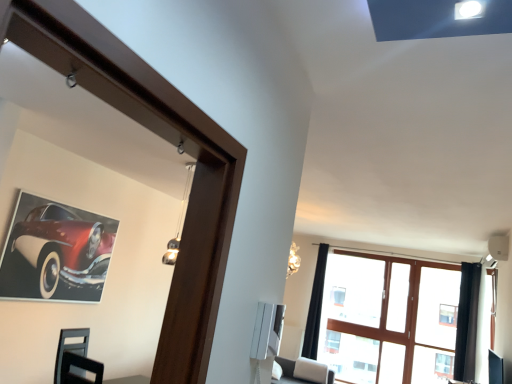
How much space does black velvet curtain at right, which appears as the 1th curtain when viewed from the right, occupy horizontally?

11.56 inches.

The width and height of the screenshot is (512, 384). What do you see at coordinates (315, 306) in the screenshot?
I see `black fabric curtain at upper right, marked as the second curtain in a right-to-left arrangement` at bounding box center [315, 306].

Find the location of a particular element. This screenshot has height=384, width=512. clear glass window at upper center is located at coordinates (391, 318).

Between clear glass window at upper center and black velvet curtain at right, which ranks as the 2th curtain in left-to-right order, which one is positioned in front?

black velvet curtain at right, which ranks as the 2th curtain in left-to-right order, is in front.

Does point (409, 359) lie in front of point (474, 348)?

No, (409, 359) is further to viewer.

Considering the sizes of objects clear glass window at upper center and black velvet curtain at right, which appears as the 2th curtain when viewed from the back, in the image provided, who is thinner, clear glass window at upper center or black velvet curtain at right, which appears as the 2th curtain when viewed from the back,?

With smaller width is clear glass window at upper center.

Considering the sizes of clear glass window at upper center and black velvet curtain at right, which ranks as the 2th curtain in left-to-right order, in the image, is clear glass window at upper center bigger or smaller than black velvet curtain at right, which ranks as the 2th curtain in left-to-right order,?

Clearly, clear glass window at upper center is larger in size than black velvet curtain at right, which ranks as the 2th curtain in left-to-right order.

Which is behind, point (403, 330) or point (321, 302)?

The point (321, 302) is farther.

Which is more to the left, clear glass window at upper center or black fabric curtain at upper right, marked as the second curtain in a right-to-left arrangement?

From the viewer's perspective, black fabric curtain at upper right, marked as the second curtain in a right-to-left arrangement, appears more on the left side.

Is clear glass window at upper center directly adjacent to black fabric curtain at upper right, marked as the second curtain in a right-to-left arrangement?

No, clear glass window at upper center is not in contact with black fabric curtain at upper right, marked as the second curtain in a right-to-left arrangement.

Is clear glass window at upper center turned away from black fabric curtain at upper right, marked as the second curtain in a right-to-left arrangement?

No, black fabric curtain at upper right, marked as the second curtain in a right-to-left arrangement, is not at the back of clear glass window at upper center.

Is point (467, 355) closer or farther from the camera than point (30, 289)?

Point (467, 355) is positioned farther from the camera compared to point (30, 289).

Looking at this image, is black velvet curtain at right, which is the first curtain from front to back, closer to the viewer compared to shiny red car at upper left?

No, it is behind shiny red car at upper left.

Considering the relative sizes of black velvet curtain at right, which is the first curtain from front to back, and shiny red car at upper left in the image provided, is black velvet curtain at right, which is the first curtain from front to back, bigger than shiny red car at upper left?

Correct, black velvet curtain at right, which is the first curtain from front to back, is larger in size than shiny red car at upper left.

Is black fabric curtain at upper right, which ranks as the first curtain in left-to-right order, wider than black velvet curtain at right, which appears as the 2th curtain when viewed from the back?

In fact, black fabric curtain at upper right, which ranks as the first curtain in left-to-right order, might be narrower than black velvet curtain at right, which appears as the 2th curtain when viewed from the back.

Is black fabric curtain at upper right, the 2th curtain from the front, at the left side of black velvet curtain at right, which appears as the 2th curtain when viewed from the back?

Correct, you'll find black fabric curtain at upper right, the 2th curtain from the front, to the left of black velvet curtain at right, which appears as the 2th curtain when viewed from the back.

At what (x,y) coordinates should I click in order to perform the action: click on curtain that is in front of the black fabric curtain at upper right, which ranks as the first curtain in left-to-right order. Please return your answer as a coordinate pair (x, y). Image resolution: width=512 pixels, height=384 pixels. Looking at the image, I should click on (467, 322).

From a real-world perspective, is black fabric curtain at upper right, which ranks as the first curtain in left-to-right order, above or below black velvet curtain at right, which ranks as the 2th curtain in left-to-right order?

black fabric curtain at upper right, which ranks as the first curtain in left-to-right order, is situated lower than black velvet curtain at right, which ranks as the 2th curtain in left-to-right order, in the real world.

Does point (79, 238) lie behind point (328, 300)?

No, it is not.

What's the angular difference between shiny red car at upper left and clear glass window at upper center's facing directions?

The angular difference between shiny red car at upper left and clear glass window at upper center is 90.5 degrees.

Where is `window below the shiny red car at upper left (from the image's perspective)`? The image size is (512, 384). window below the shiny red car at upper left (from the image's perspective) is located at coordinates (391, 318).

Is shiny red car at upper left shorter than clear glass window at upper center?

Correct, shiny red car at upper left is not as tall as clear glass window at upper center.

From their relative heights in the image, would you say shiny red car at upper left is taller or shorter than black velvet curtain at right, which is the first curtain from front to back?

Clearly, shiny red car at upper left is shorter compared to black velvet curtain at right, which is the first curtain from front to back.

Is shiny red car at upper left to the left of black velvet curtain at right, which appears as the 2th curtain when viewed from the back, from the viewer's perspective?

Indeed, shiny red car at upper left is positioned on the left side of black velvet curtain at right, which appears as the 2th curtain when viewed from the back.

How many degrees apart are the facing directions of shiny red car at upper left and black velvet curtain at right, which appears as the 1th curtain when viewed from the right?

The angle between the facing direction of shiny red car at upper left and the facing direction of black velvet curtain at right, which appears as the 1th curtain when viewed from the right, is 94.4 degrees.

Considering their positions, is shiny red car at upper left located in front of or behind black velvet curtain at right, which appears as the 2th curtain when viewed from the back?

Clearly, shiny red car at upper left is in front of black velvet curtain at right, which appears as the 2th curtain when viewed from the back.

From the image's perspective, between clear glass window at upper center and shiny red car at upper left, who is located below?

clear glass window at upper center.

How many degrees apart are the facing directions of clear glass window at upper center and shiny red car at upper left?

The angle between the facing direction of clear glass window at upper center and the facing direction of shiny red car at upper left is 90.5 degrees.

Is clear glass window at upper center further to camera compared to shiny red car at upper left?

That is True.

Is clear glass window at upper center smaller than shiny red car at upper left?

No, clear glass window at upper center is not smaller than shiny red car at upper left.

The height and width of the screenshot is (384, 512). Identify the location of window on the left side of black velvet curtain at right, which appears as the 1th curtain when viewed from the right. (391, 318).

Find the location of a particular element. The image size is (512, 384). curtain that is the 1st one when counting upward from the clear glass window at upper center (from the image's perspective) is located at coordinates (315, 306).

Which object lies further to the anchor point black fabric curtain at upper right, the 2th curtain from the front, black velvet curtain at right, which appears as the 1th curtain when viewed from the right, or shiny red car at upper left?

The object further to black fabric curtain at upper right, the 2th curtain from the front, is shiny red car at upper left.

Estimate the real-world distances between objects in this image. Which object is further from black velvet curtain at right, which is the first curtain from front to back, clear glass window at upper center or shiny red car at upper left?

shiny red car at upper left is further to black velvet curtain at right, which is the first curtain from front to back.

Estimate the real-world distances between objects in this image. Which object is further from shiny red car at upper left, black fabric curtain at upper right, marked as the 1th curtain in a back-to-front arrangement, or clear glass window at upper center?

clear glass window at upper center lies further to shiny red car at upper left than the other object.

Considering their positions, is black velvet curtain at right, which ranks as the 2th curtain in left-to-right order, positioned closer to black fabric curtain at upper right, the 2th curtain from the front, than clear glass window at upper center?

Among the two, clear glass window at upper center is located nearer to black fabric curtain at upper right, the 2th curtain from the front.

From the image, which object appears to be farther from shiny red car at upper left, clear glass window at upper center or black velvet curtain at right, which ranks as the 2th curtain in left-to-right order?

The object further to shiny red car at upper left is black velvet curtain at right, which ranks as the 2th curtain in left-to-right order.

Considering their positions, is black velvet curtain at right, which appears as the 1th curtain when viewed from the right, positioned further to shiny red car at upper left than black fabric curtain at upper right, marked as the 1th curtain in a back-to-front arrangement?

Among the two, black velvet curtain at right, which appears as the 1th curtain when viewed from the right, is located further to shiny red car at upper left.

Estimate the real-world distances between objects in this image. Which object is closer to shiny red car at upper left, black fabric curtain at upper right, marked as the 1th curtain in a back-to-front arrangement, or black velvet curtain at right, which appears as the 1th curtain when viewed from the right?

Based on the image, black fabric curtain at upper right, marked as the 1th curtain in a back-to-front arrangement, appears to be nearer to shiny red car at upper left.

Estimate the real-world distances between objects in this image. Which object is further from black fabric curtain at upper right, the 2th curtain from the front, shiny red car at upper left or black velvet curtain at right, which appears as the 1th curtain when viewed from the right?

The object further to black fabric curtain at upper right, the 2th curtain from the front, is shiny red car at upper left.

Locate an element on the screen. curtain between shiny red car at upper left and black velvet curtain at right, which is the first curtain from front to back is located at coordinates (315, 306).

Find the location of `window located between shiny red car at upper left and black velvet curtain at right, which ranks as the 2th curtain in left-to-right order, in the left-right direction`. window located between shiny red car at upper left and black velvet curtain at right, which ranks as the 2th curtain in left-to-right order, in the left-right direction is located at coordinates (391, 318).

This screenshot has height=384, width=512. Identify the location of curtain between shiny red car at upper left and clear glass window at upper center from left to right. (315, 306).

I want to click on window between black fabric curtain at upper right, the 2th curtain from the front, and black velvet curtain at right, which appears as the 1th curtain when viewed from the right, so click(x=391, y=318).